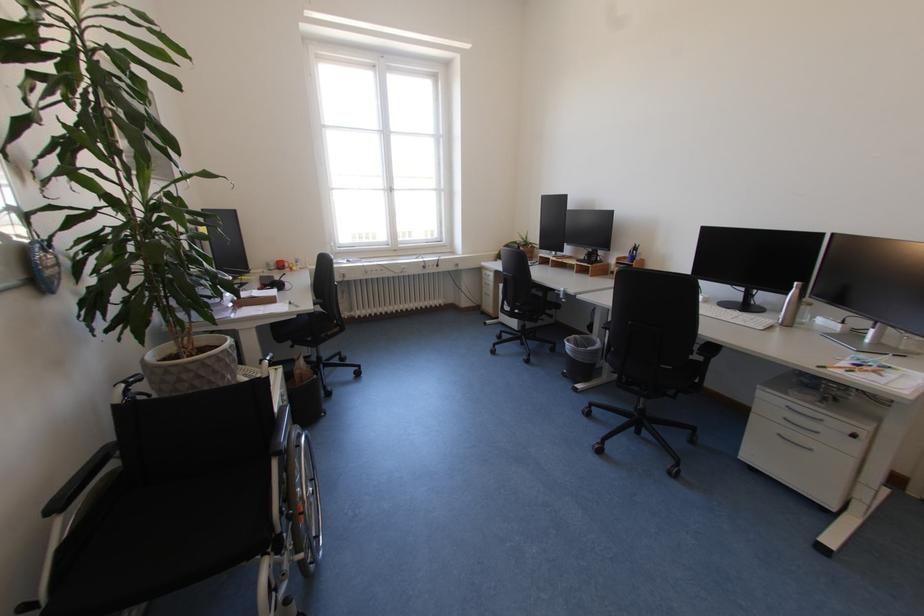
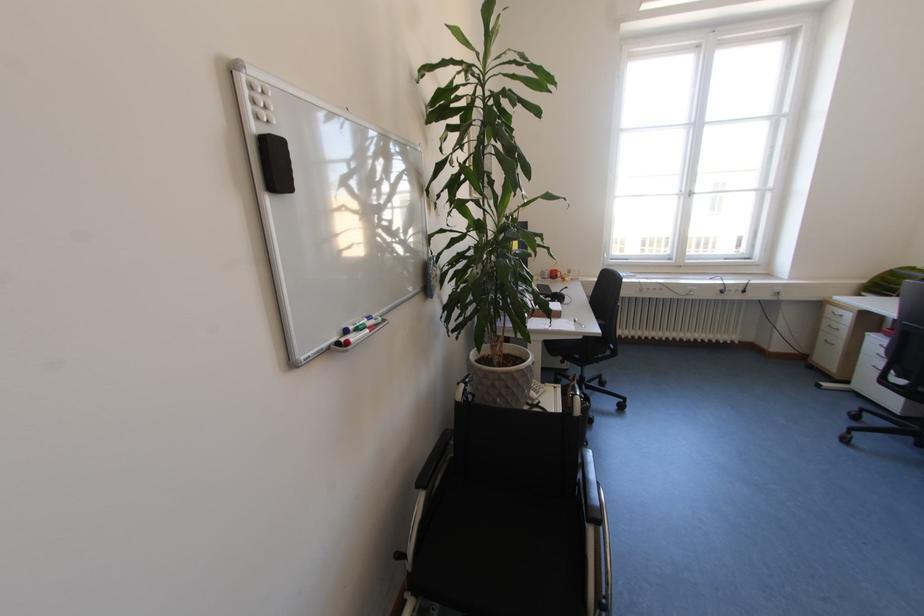
Where in the second image is the point corresponding to point 281,270 from the first image?

(553, 278)